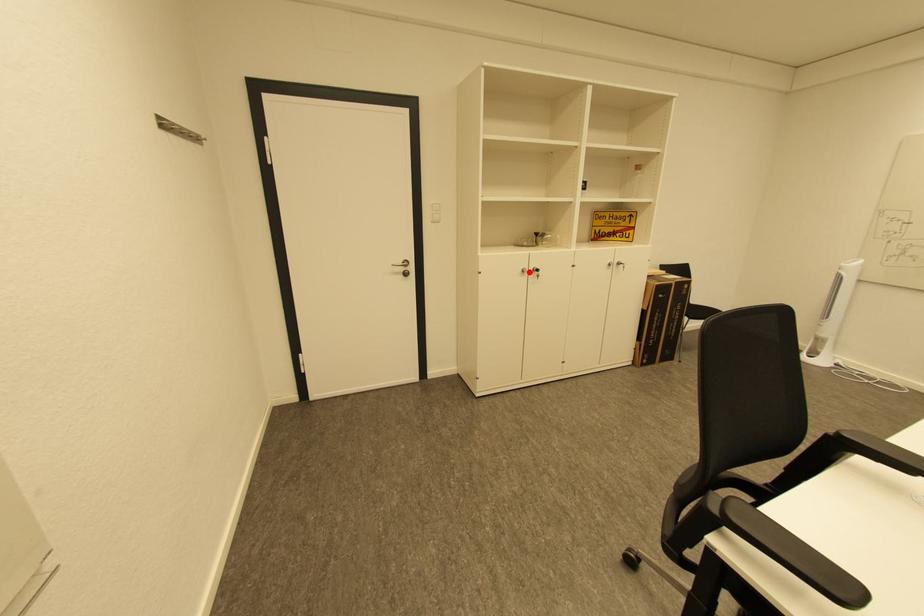
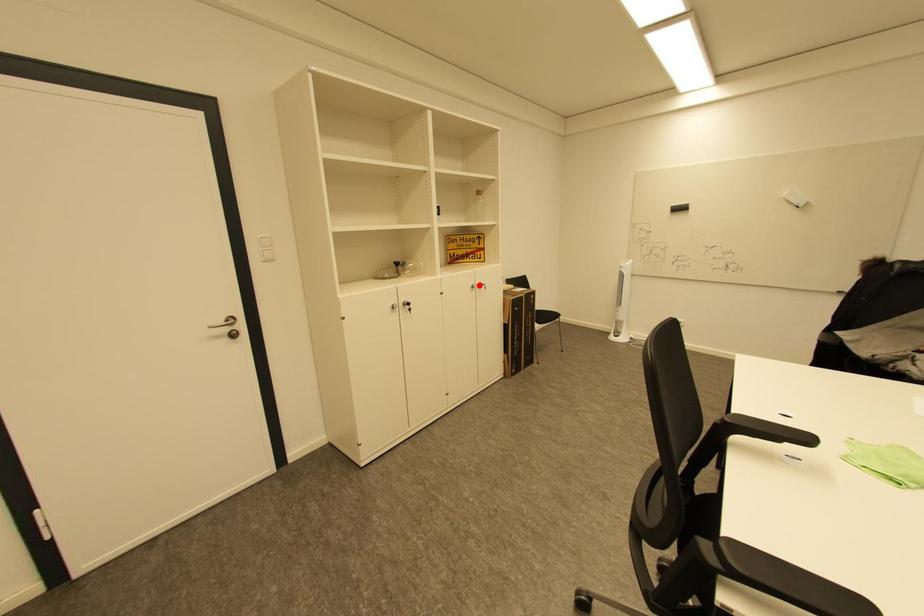
I am providing you with two images of the same scene from different viewpoints. A red point is marked on the first image and another point is marked on the second image. Are the points marked in image1 and image2 representing the same 3D position?

No